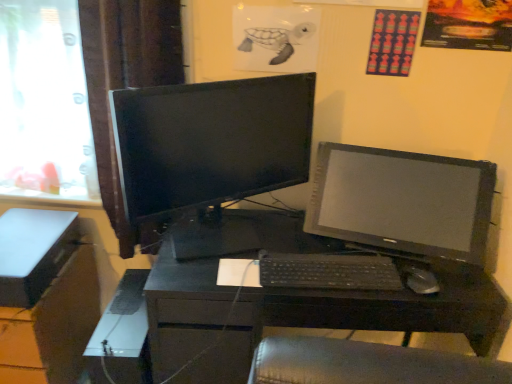
In order to click on free space above black matte desk at center (from a real-world perspective) in this screenshot , I will do `click(285, 248)`.